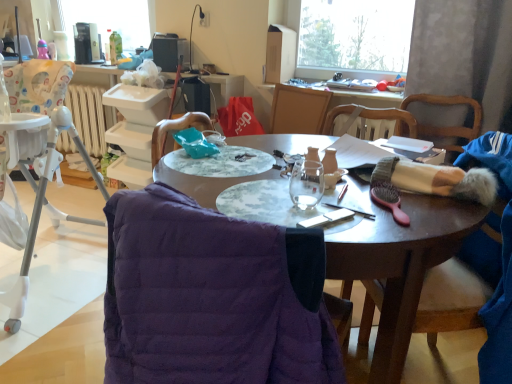
At what (x,y) coordinates should I click in order to perform the action: click on vacant area to the right of silver metallic phone at center. Please return your answer as a coordinate pair (x, y). The height and width of the screenshot is (384, 512). Looking at the image, I should click on click(392, 221).